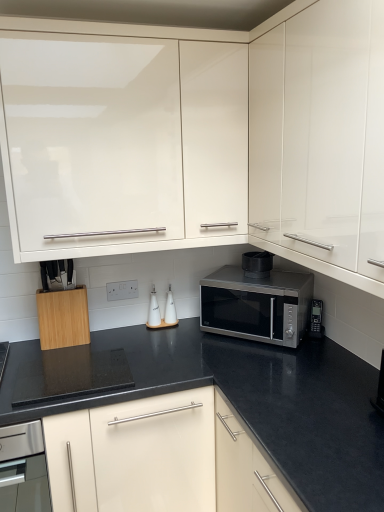
Locate an element on the screen. The width and height of the screenshot is (384, 512). free spot to the left of black matte microwave at center, the 2th appliance from the right is located at coordinates (231, 275).